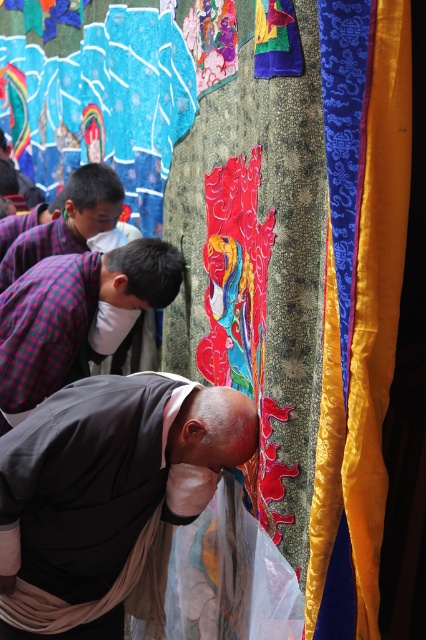
You are an observer standing in the same room as the gray fabric monk at center and the plaid fabric shirt at center. Which of these two objects appears bigger to you?

The gray fabric monk at center appears bigger than the plaid fabric shirt at center because it is larger in size according to the description.